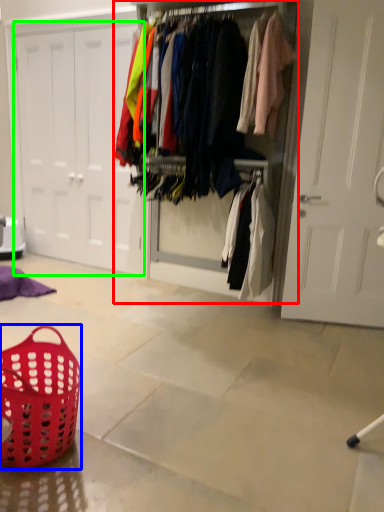
Question: Which is farther away from closet (highlighted by a red box)? basket (highlighted by a blue box) or door (highlighted by a green box)?

Choices:
 (A) basket
 (B) door

Answer: (A)